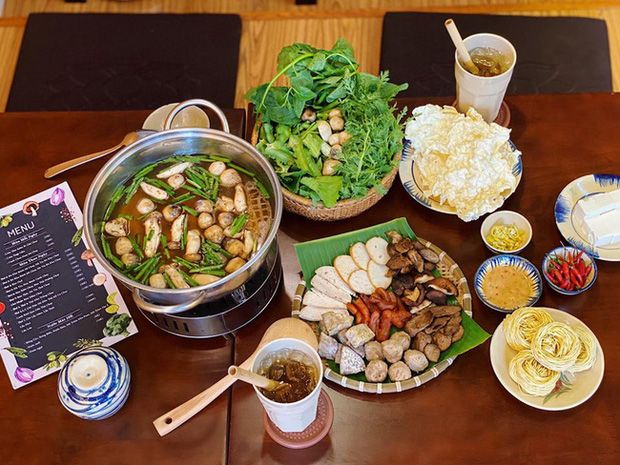
Identify the location of cup. (284, 430), (489, 143).